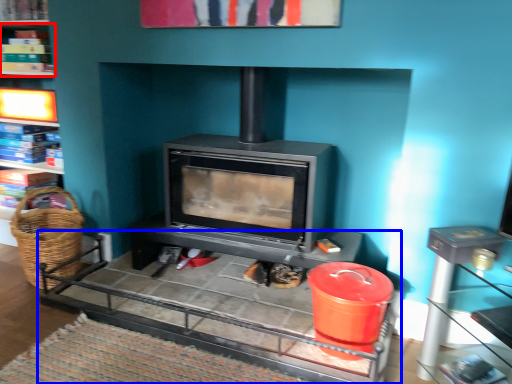
Question: Which object is further to the camera taking this photo, shelf (highlighted by a red box) or table (highlighted by a blue box)?

Choices:
 (A) shelf
 (B) table

Answer: (A)